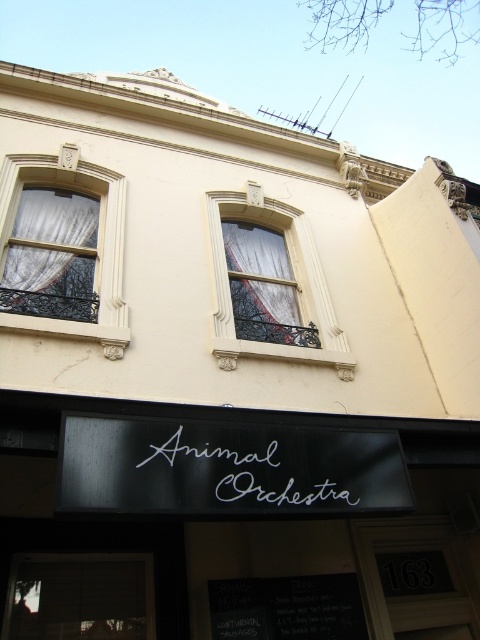
Between white textured window at center and white textured curtain at upper left, which one is positioned lower?

white textured window at center is below.

Can you confirm if white textured window at center is taller than white textured curtain at upper left?

Indeed, white textured window at center has a greater height compared to white textured curtain at upper left.

Locate an element on the screen. Image resolution: width=480 pixels, height=640 pixels. white textured window at center is located at coordinates (292, 273).

Which is below, white textured window at center or white sheer curtain at center?

white sheer curtain at center

Does white textured window at center have a smaller size compared to white sheer curtain at center?

No.

Which is behind, point (308, 253) or point (267, 252)?

The point (267, 252) is behind.

Image resolution: width=480 pixels, height=640 pixels. Identify the location of white textured window at center. (292, 273).

Between white textured curtain at upper left and white script at center, which one has more height?

white textured curtain at upper left is taller.

Is white textured curtain at upper left wider than white script at center?

Indeed, white textured curtain at upper left has a greater width compared to white script at center.

Is point (21, 180) farther from viewer compared to point (231, 476)?

Yes, point (21, 180) is farther from viewer.

The height and width of the screenshot is (640, 480). In order to click on white textured curtain at upper left in this screenshot , I will do `click(96, 250)`.